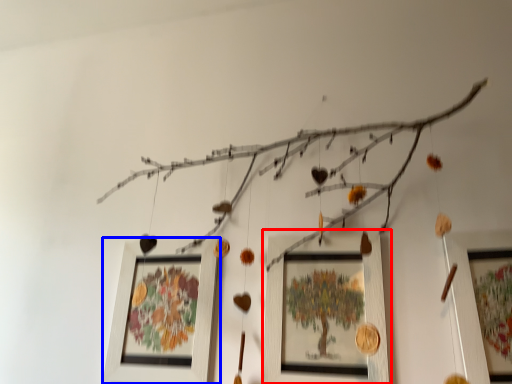
Question: Which of the following is the closest to the observer, picture frame (highlighted by a red box) or picture frame (highlighted by a blue box)?

Choices:
 (A) picture frame
 (B) picture frame

Answer: (A)